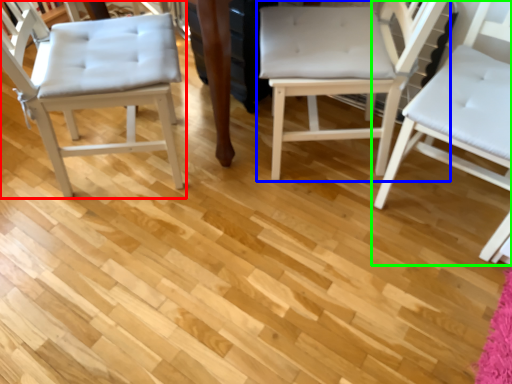
Question: Which object is positioned closest to chair (highlighted by a red box)? Select from chair (highlighted by a blue box) and chair (highlighted by a green box).

Choices:
 (A) chair
 (B) chair

Answer: (A)